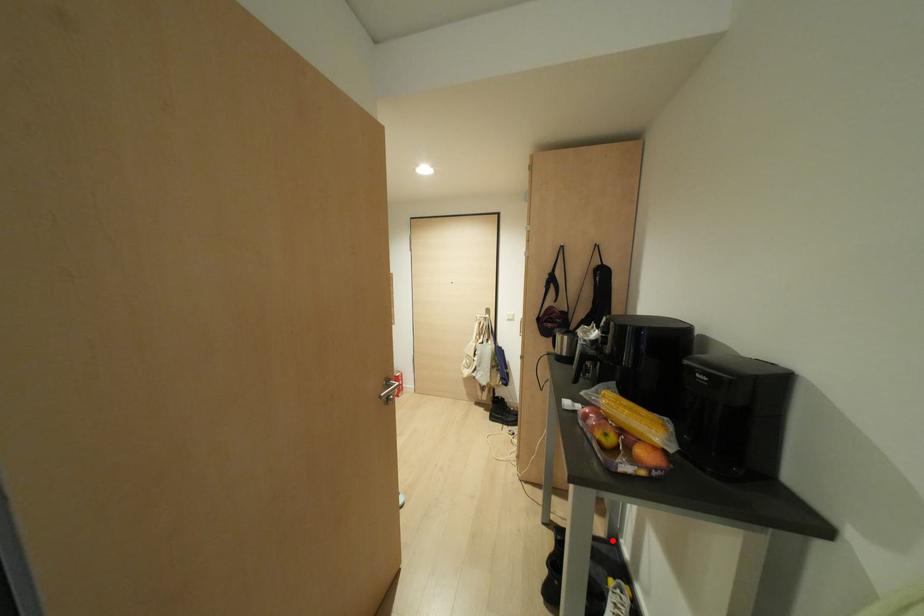
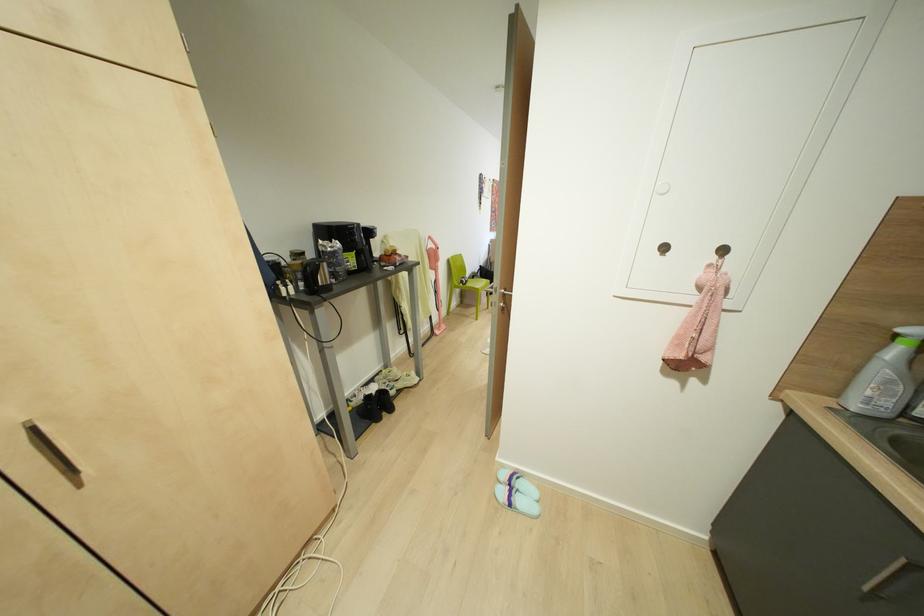
Question: I am providing you with two images of the same scene from different viewpoints. A red point is marked on the first image. Is the red point's position out of view in image 2?

Choices:
 (A) Yes
 (B) No

Answer: (A)